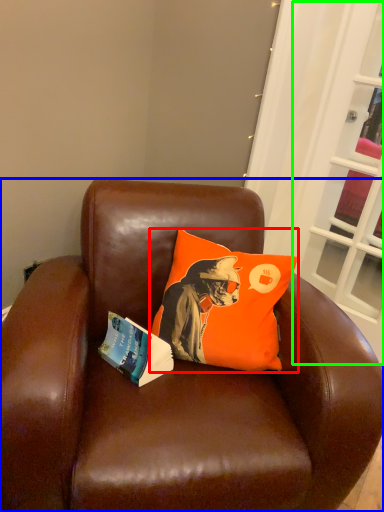
Question: Which is nearer to the pillow (highlighted by a red box)? chair (highlighted by a blue box) or screen door (highlighted by a green box).

Choices:
 (A) chair
 (B) screen door

Answer: (A)